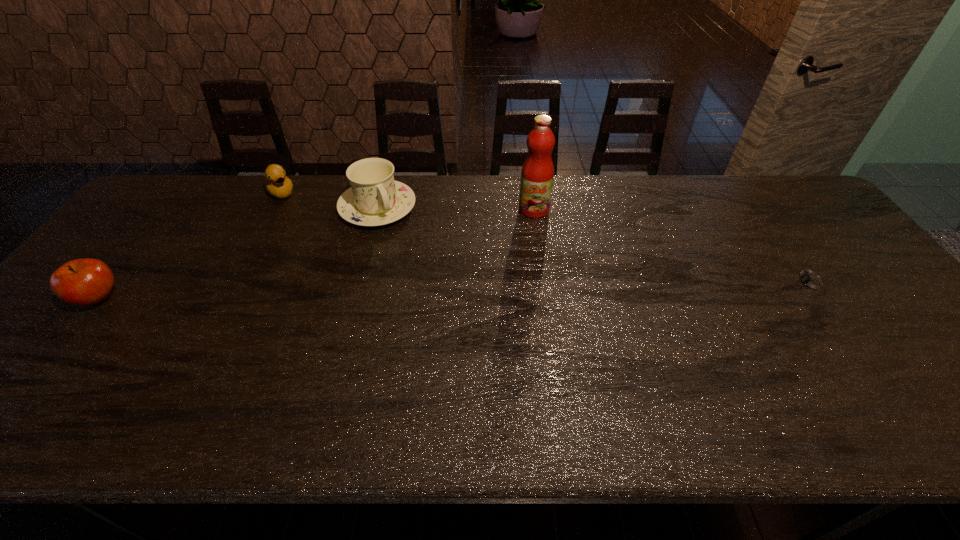
The image size is (960, 540). Identify the location of fruit juice that is at the far edge. (537, 174).

Locate an element on the screen. chinaware at the far edge is located at coordinates 374,199.

This screenshot has height=540, width=960. In order to click on duckling that is at the far edge in this screenshot , I will do `click(277, 183)`.

At what (x,y) coordinates should I click in order to perform the action: click on object situated at the left edge. Please return your answer as a coordinate pair (x, y). The image size is (960, 540). Looking at the image, I should click on (84, 282).

This screenshot has width=960, height=540. I want to click on object at the right edge, so click(811, 283).

The image size is (960, 540). Find the location of `vacant space at the far edge of the desktop`. vacant space at the far edge of the desktop is located at coordinates (488, 190).

In the image, there is a desktop. What are the coordinates of `vacant space at the near edge` in the screenshot? It's located at (340, 358).

Locate an element on the screen. vacant space at the right edge of the desktop is located at coordinates (861, 307).

Identify the location of free space at the far right corner of the desktop. Image resolution: width=960 pixels, height=540 pixels. (796, 208).

At what (x,y) coordinates should I click in order to perform the action: click on vacant space at the near right corner of the desktop. Please return your answer as a coordinate pair (x, y). Looking at the image, I should click on (896, 377).